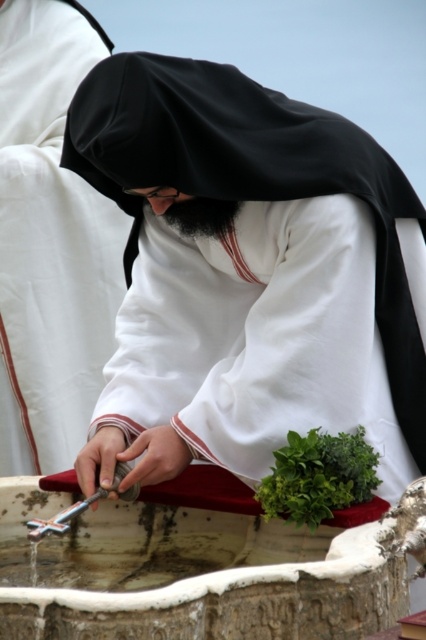
Can you confirm if white matte cloth at center is smaller than green leafy at center?

Actually, white matte cloth at center might be larger than green leafy at center.

Find the location of a particular element. The image size is (426, 640). white matte cloth at center is located at coordinates (249, 275).

You are a GUI agent. You are given a task and a screenshot of the screen. Output one action in this format:
    pyautogui.click(x=<x>, y=<y>)
    Task: Click on the white matte cloth at center
    
    Given the screenshot: What is the action you would take?
    point(249,275)